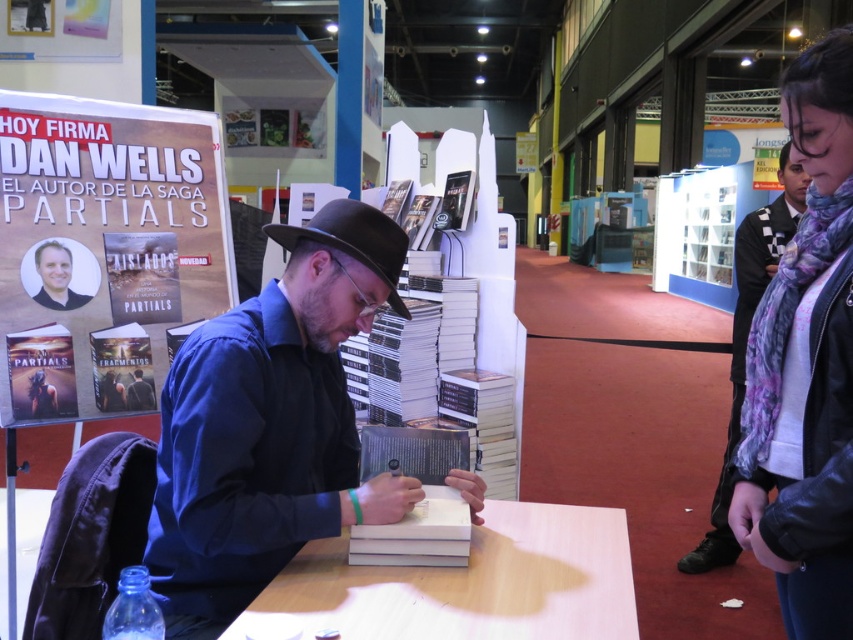
Question: Which point is farther to the camera?

Choices:
 (A) purple scarf at right
 (B) wooden table at center
 (C) purple scarf at upper right
 (D) brown felt fedora at center

Answer: (A)

Question: Observing the image, what is the correct spatial positioning of wooden table at center in reference to white paper at center?

Choices:
 (A) left
 (B) right

Answer: (B)

Question: Does black matte shirt at center have a greater width compared to wooden table at center?

Choices:
 (A) yes
 (B) no

Answer: (B)

Question: Estimate the real-world distances between objects in this image. Which object is farther from the purple scarf at upper right?

Choices:
 (A) matte paper poster at upper left
 (B) white paper at center
 (C) brown felt fedora at center
 (D) purple scarf at right

Answer: (A)

Question: Which of these objects is positioned closest to the purple scarf at upper right?

Choices:
 (A) wooden table at center
 (B) white paper at center
 (C) black matte shirt at center

Answer: (A)

Question: Observing the image, what is the correct spatial positioning of black matte shirt at center in reference to matte paper poster at upper left?

Choices:
 (A) below
 (B) above

Answer: (A)